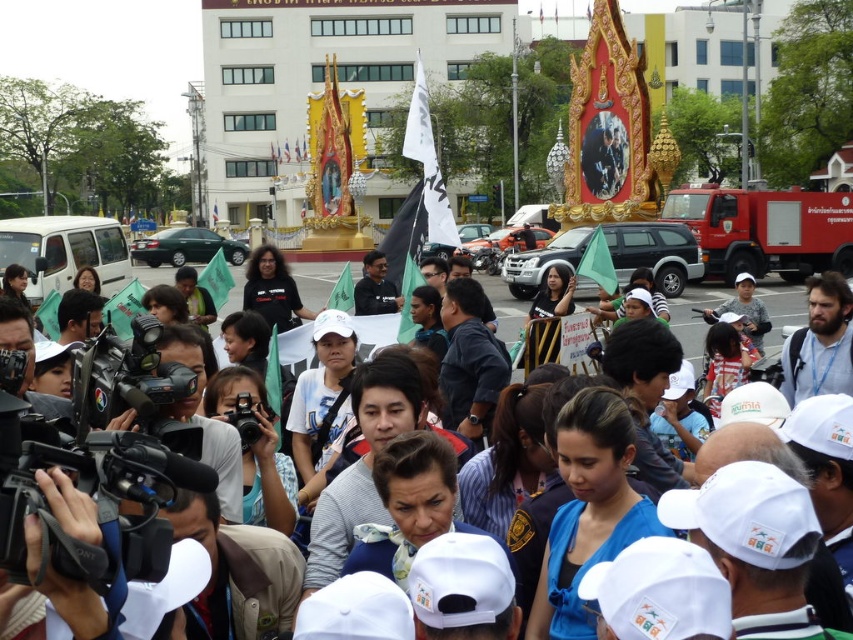
You are a photographer trying to capture the entire scene of the protest. You notice the red matte fire truck at right and the white fabric flag at center. Which object is narrower in width?

The red matte fire truck at right is narrower in width than the white fabric flag at center.

You are a photographer planning to capture the red matte fire truck at right and the white fabric flag at center in the same frame. Based on their heights, which object will appear taller in the photo?

The white fabric flag at center is taller than the red matte fire truck at right, so it will appear taller in the photo.

You are a photographer trying to capture a clear shot of the white fabric flag at center. However, there is a red matte fire truck at right in the way. Can you adjust your position to see the flag without the fire truck blocking it?

The white fabric flag at center is behind the red matte fire truck at right, so moving to a position where the fire truck is no longer between you and the flag would allow you to see it clearly.